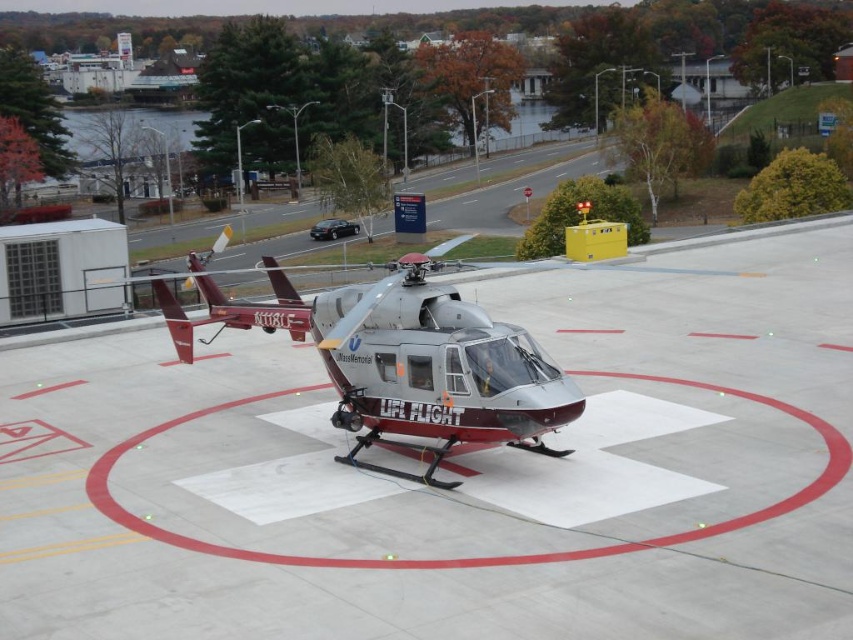
Question: Which point appears farthest from the camera in this image?

Choices:
 (A) (125, 483)
 (B) (318, 307)

Answer: (B)

Question: Does smooth concrete tarmac at center come behind maroon metallic helicopter at center?

Choices:
 (A) no
 (B) yes

Answer: (A)

Question: Is smooth concrete tarmac at center to the left of maroon metallic helicopter at center from the viewer's perspective?

Choices:
 (A) yes
 (B) no

Answer: (B)

Question: Which point appears farthest from the camera in this image?

Choices:
 (A) (47, 596)
 (B) (386, 330)

Answer: (B)

Question: Is smooth concrete tarmac at center bigger than maroon metallic helicopter at center?

Choices:
 (A) no
 (B) yes

Answer: (B)